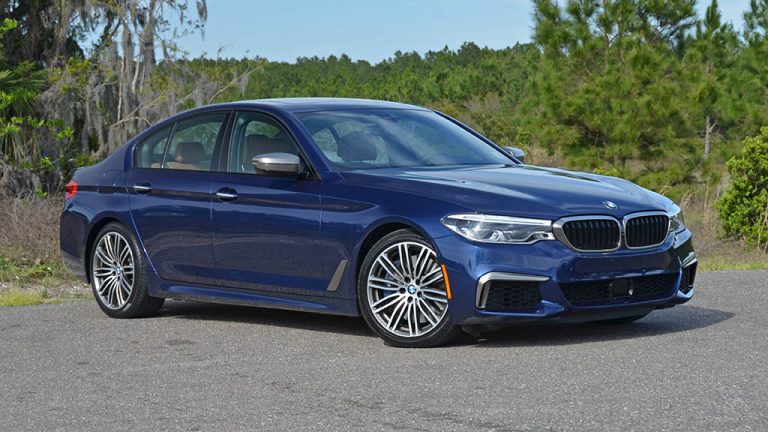
Locate an element on the screen. The image size is (768, 432). window is located at coordinates (259, 138), (192, 145).